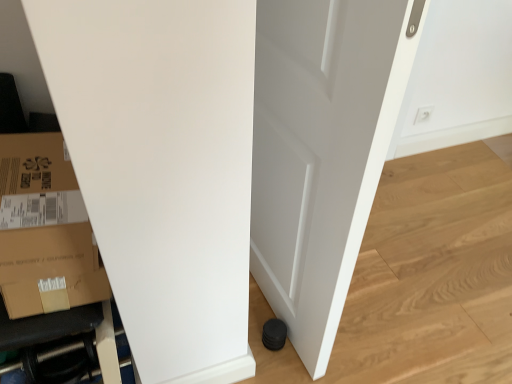
This screenshot has height=384, width=512. Describe the element at coordinates (423, 114) in the screenshot. I see `white plastic electric outlet at upper right` at that location.

Where is `brown cardboard box at lower left`? Image resolution: width=512 pixels, height=384 pixels. brown cardboard box at lower left is located at coordinates (50, 267).

Find the location of a particular element. black rubber hose at lower left is located at coordinates (65, 345).

Where is `white plastic electric outlet at upper right`? This screenshot has height=384, width=512. white plastic electric outlet at upper right is located at coordinates (423, 114).

Which object is thinner, black rubber hose at lower left or white matte door at center?

With smaller width is white matte door at center.

Considering the relative sizes of black rubber hose at lower left and white matte door at center in the image provided, is black rubber hose at lower left shorter than white matte door at center?

Yes.

Is black rubber hose at lower left closer to the viewer compared to white matte door at center?

No, black rubber hose at lower left is further to the viewer.

Are black rubber hose at lower left and white matte door at center located far from each other?

No, black rubber hose at lower left is in close proximity to white matte door at center.

Is white plastic electric outlet at upper right looking in the opposite direction of white matte door at center?

white plastic electric outlet at upper right is not turned away from white matte door at center.

From the image's perspective, is white plastic electric outlet at upper right positioned above or below white matte door at center?

Based on their image positions, white plastic electric outlet at upper right is located above white matte door at center.

At what (x,y) coordinates should I click in order to perform the action: click on electric outlet above the white matte door at center (from the image's perspective). Please return your answer as a coordinate pair (x, y). The width and height of the screenshot is (512, 384). Looking at the image, I should click on (423, 114).

Is point (417, 116) in front of point (304, 27)?

That is False.

Which of these two, white plastic electric outlet at upper right or black rubber hose at lower left, is smaller?

white plastic electric outlet at upper right is smaller.

Is white plastic electric outlet at upper right inside or outside of black rubber hose at lower left?

white plastic electric outlet at upper right is spatially situated outside black rubber hose at lower left.

You are a GUI agent. You are given a task and a screenshot of the screen. Output one action in this format:
    pyautogui.click(x=<x>, y=<y>)
    Task: Click on the electric outlet on the right side of black rubber hose at lower left
    The height and width of the screenshot is (384, 512).
    Given the screenshot: What is the action you would take?
    pyautogui.click(x=423, y=114)

Can you tell me how much white plastic electric outlet at upper right and black rubber hose at lower left differ in facing direction?

1.76 degrees separate the facing orientations of white plastic electric outlet at upper right and black rubber hose at lower left.

Can you confirm if brown cardboard box at lower left is thinner than white plastic electric outlet at upper right?

No.

Which point is more forward, (17,305) or (426,114)?

The point (17,305) is closer to the camera.

I want to click on electric outlet behind the brown cardboard box at lower left, so coord(423,114).

Which is correct: brown cardboard box at lower left is inside white plastic electric outlet at upper right, or outside of it?

brown cardboard box at lower left is not enclosed by white plastic electric outlet at upper right.

How distant is brown cardboard box at lower left from black rubber hose at lower left?

brown cardboard box at lower left and black rubber hose at lower left are 7.35 inches apart from each other.

Is the position of brown cardboard box at lower left less distant than that of black rubber hose at lower left?

Yes, brown cardboard box at lower left is closer to the viewer.

From a real-world perspective, does brown cardboard box at lower left sit lower than black rubber hose at lower left?

No, from a real-world perspective, brown cardboard box at lower left is not under black rubber hose at lower left.

From the image's perspective, is brown cardboard box at lower left below black rubber hose at lower left?

No.

From the image's perspective, is black rubber hose at lower left located above or below brown cardboard box at lower left?

Based on their image positions, black rubber hose at lower left is located beneath brown cardboard box at lower left.

From their relative heights in the image, would you say black rubber hose at lower left is taller or shorter than brown cardboard box at lower left?

Clearly, black rubber hose at lower left is shorter compared to brown cardboard box at lower left.

This screenshot has width=512, height=384. Identify the location of cardboard box in front of the black rubber hose at lower left. (50, 267).

Which point is more forward, [401,63] or [49,182]?

The point [401,63] is closer to the camera.

Is white matte door at center positioned with its back to brown cardboard box at lower left?

Yes, white matte door at center is facing away from brown cardboard box at lower left.

Is brown cardboard box at lower left located within white matte door at center?

Definitely not — brown cardboard box at lower left is not inside white matte door at center.

What are the coordinates of `door lying on the right of black rubber hose at lower left` in the screenshot? It's located at (321, 151).

You are a GUI agent. You are given a task and a screenshot of the screen. Output one action in this format:
    pyautogui.click(x=<x>, y=<y>)
    Task: Click on the door that is above the white plastic electric outlet at upper right (from a real-world perspective)
    The width and height of the screenshot is (512, 384).
    Given the screenshot: What is the action you would take?
    pyautogui.click(x=321, y=151)

When comparing their distances from white plastic electric outlet at upper right, does brown cardboard box at lower left or white matte door at center seem further?

brown cardboard box at lower left.

Estimate the real-world distances between objects in this image. Which object is closer to white matte door at center, brown cardboard box at lower left or black rubber hose at lower left?

Among the two, brown cardboard box at lower left is located nearer to white matte door at center.

Based on the photo, which object lies nearer to the anchor point white plastic electric outlet at upper right, white matte door at center or black rubber hose at lower left?

white matte door at center.

Considering their positions, is white plastic electric outlet at upper right positioned further to brown cardboard box at lower left than black rubber hose at lower left?

Based on the image, white plastic electric outlet at upper right appears to be further to brown cardboard box at lower left.

Estimate the real-world distances between objects in this image. Which object is closer to white plastic electric outlet at upper right, black rubber hose at lower left or white matte door at center?

white matte door at center lies closer to white plastic electric outlet at upper right than the other object.

From the image, which object appears to be farther from white matte door at center, brown cardboard box at lower left or white plastic electric outlet at upper right?

Among the two, white plastic electric outlet at upper right is located further to white matte door at center.

From the image, which object appears to be farther from black rubber hose at lower left, brown cardboard box at lower left or white matte door at center?

white matte door at center is further to black rubber hose at lower left.

When comparing their distances from black rubber hose at lower left, does white plastic electric outlet at upper right or white matte door at center seem closer?

white matte door at center.

Locate an element on the screen. The image size is (512, 384). cardboard box between white matte door at center and white plastic electric outlet at upper right along the z-axis is located at coordinates (50, 267).

Locate an element on the screen. cardboard box located between black rubber hose at lower left and white matte door at center in the left-right direction is located at coordinates coord(50,267).

Where is `furniture between white matte door at center and white plastic electric outlet at upper right along the z-axis`? The image size is (512, 384). furniture between white matte door at center and white plastic electric outlet at upper right along the z-axis is located at coordinates (65, 345).

You are a GUI agent. You are given a task and a screenshot of the screen. Output one action in this format:
    pyautogui.click(x=<x>, y=<y>)
    Task: Click on the cardboard box between black rubber hose at lower left and white plastic electric outlet at upper right
    The height and width of the screenshot is (384, 512).
    Given the screenshot: What is the action you would take?
    pyautogui.click(x=50, y=267)